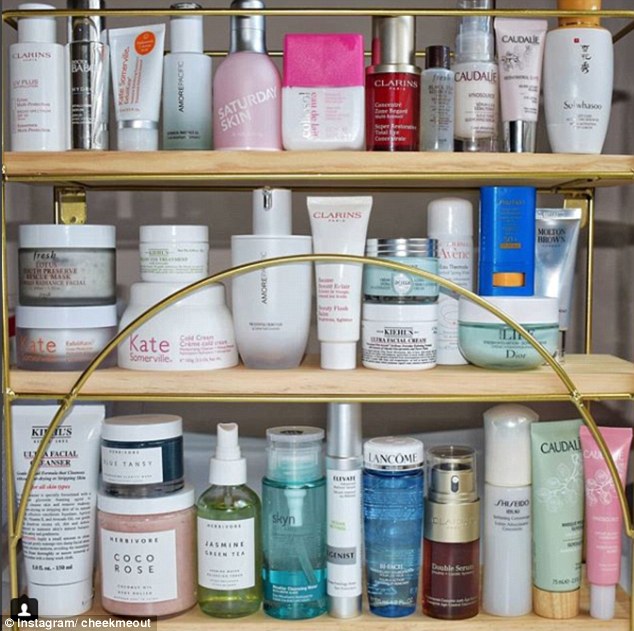
Where is `bottom wooden shelf`? Image resolution: width=634 pixels, height=631 pixels. bottom wooden shelf is located at coordinates (250, 628), (377, 627), (480, 628).